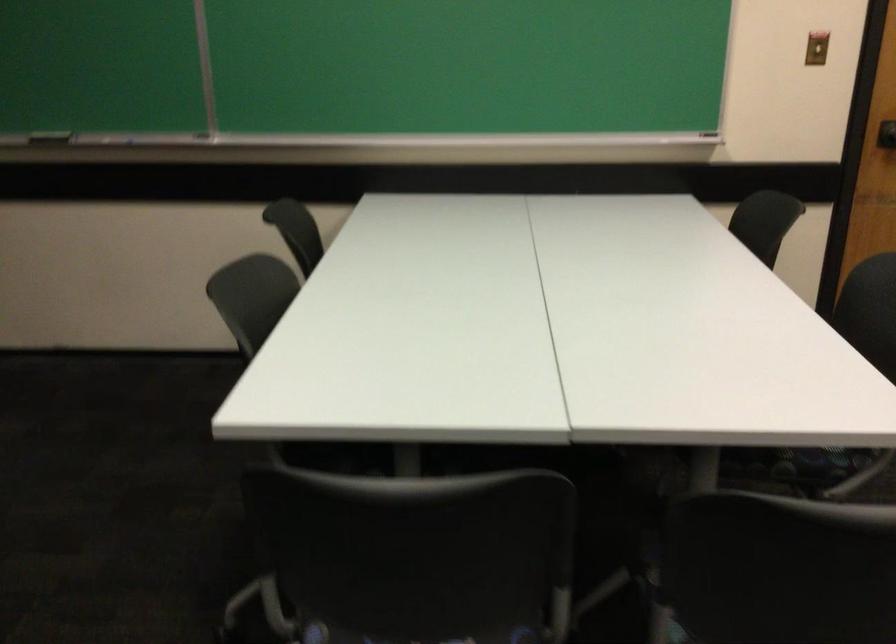
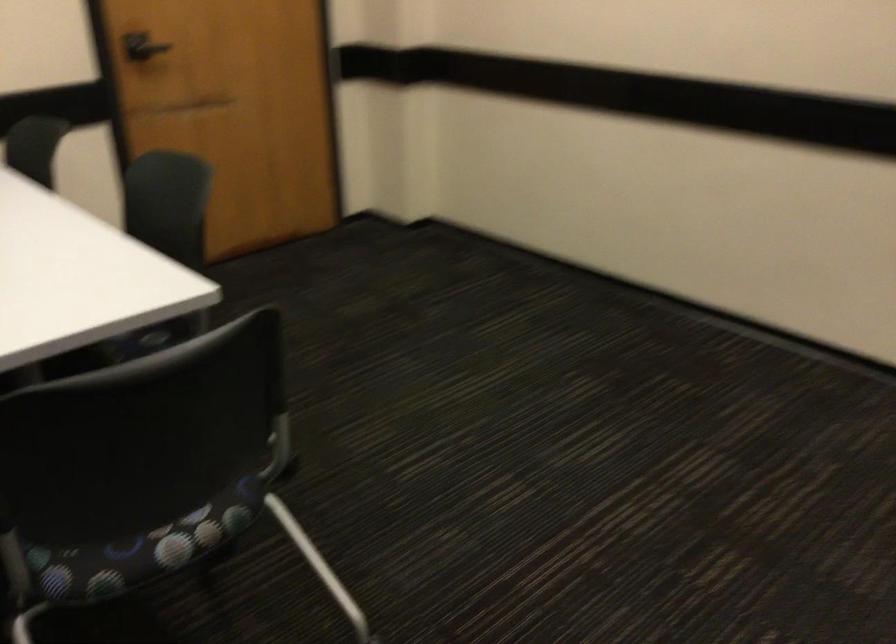
Question: The first image is from the beginning of the video and the second image is from the end. How did the camera likely rotate when shooting the video?

Choices:
 (A) Left
 (B) Right
 (C) Up
 (D) Down

Answer: (B)